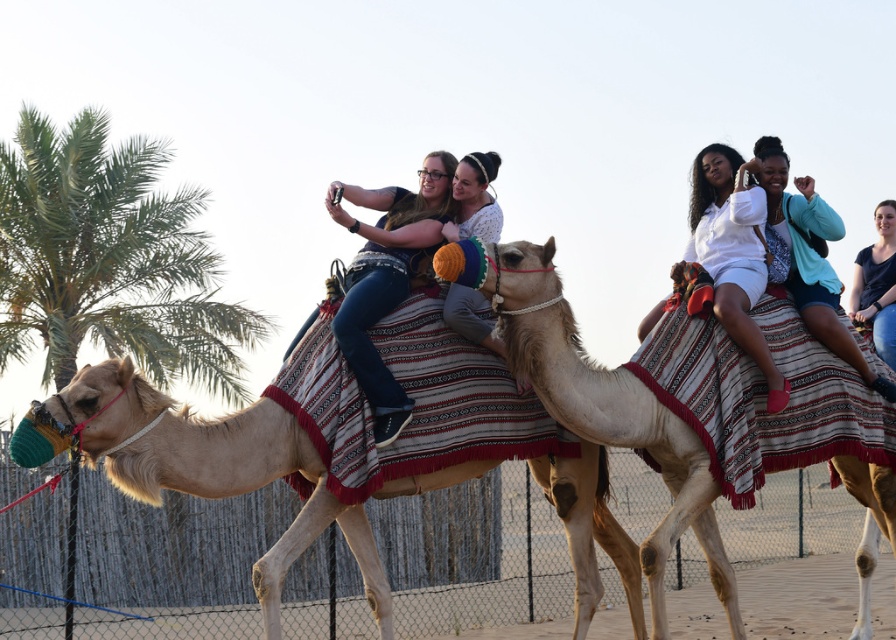
You are a photographer trying to capture a photo of the light beige camel at center and the white matte shirt at upper center. Which object should you focus on first if you want to ensure both are in the frame without moving the camera?

You should focus on the light beige camel at center first because it is larger in size than the white matte shirt at upper center, so it will take up more space in the frame and requires proper framing before adjusting for the smaller object.